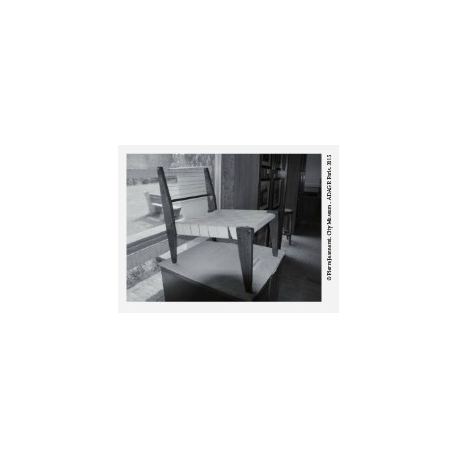
What are the coordinates of `3 chair legs` in the screenshot? It's located at (251, 237), (279, 238), (172, 249).